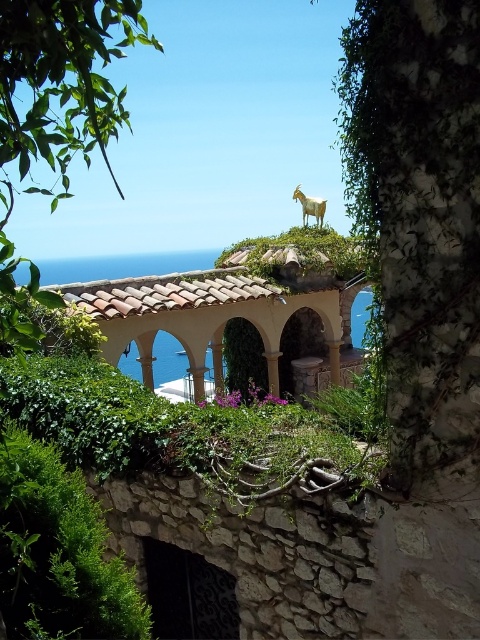
Question: Is terracotta tiled gazebo at center thinner than green leafy plant at lower left?

Choices:
 (A) no
 (B) yes

Answer: (A)

Question: Does terracotta tiled gazebo at center appear over golden metallic goat at upper center?

Choices:
 (A) yes
 (B) no

Answer: (B)

Question: Which point appears farthest from the camera in this image?

Choices:
 (A) (135, 321)
 (B) (324, 198)
 (C) (70, 552)

Answer: (B)

Question: Is terracotta tiled gazebo at center above green leafy plant at lower left?

Choices:
 (A) yes
 (B) no

Answer: (A)

Question: Which of the following is the closest to the observer?

Choices:
 (A) terracotta tiled gazebo at center
 (B) green leafy plant at lower left
 (C) golden metallic goat at upper center

Answer: (B)

Question: Which point appears closest to the camera in this image?

Choices:
 (A) (117, 284)
 (B) (45, 506)

Answer: (B)